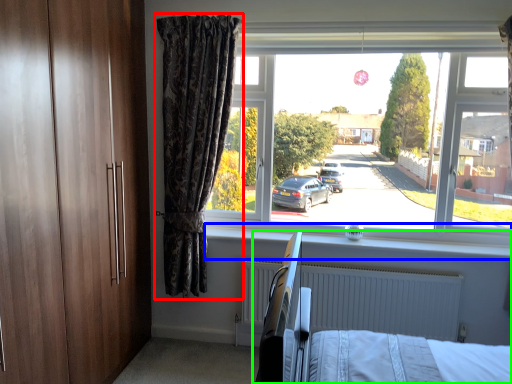
Question: Estimate the real-world distances between objects in this image. Which object is farther from curtain (highlighted by a red box), window sill (highlighted by a blue box) or hospital bed (highlighted by a green box)?

Choices:
 (A) window sill
 (B) hospital bed

Answer: (B)